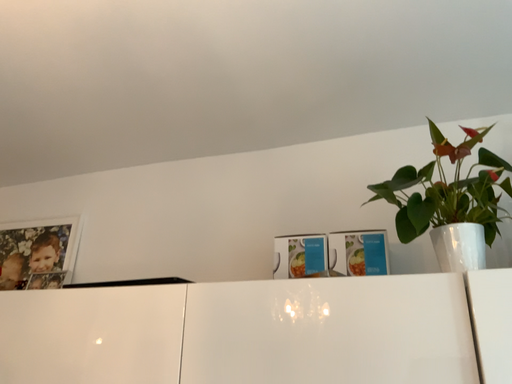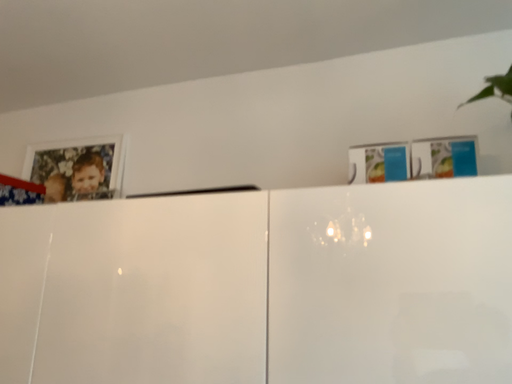
Question: Which way did the camera rotate in the video?

Choices:
 (A) rotated upward
 (B) rotated downward

Answer: (B)